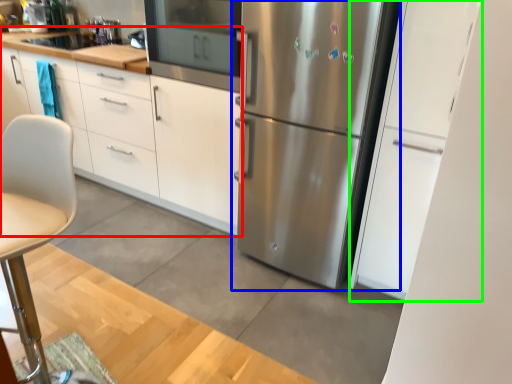
Question: Considering the real-world distances, which object is closest to cabinetry (highlighted by a red box)? refrigerator (highlighted by a blue box) or cabinetry (highlighted by a green box).

Choices:
 (A) refrigerator
 (B) cabinetry

Answer: (A)